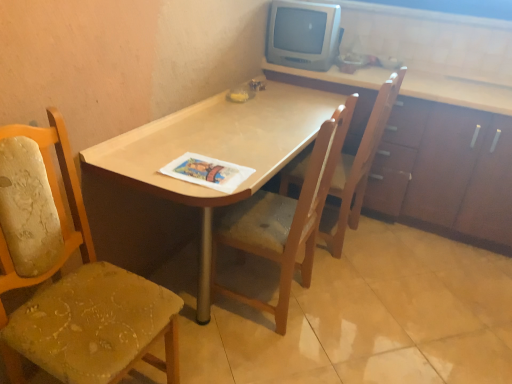
Find the location of a particular element. The image size is (512, 384). vacant area that lies in front of wooden chair at center, the third chair viewed from the left is located at coordinates (355, 284).